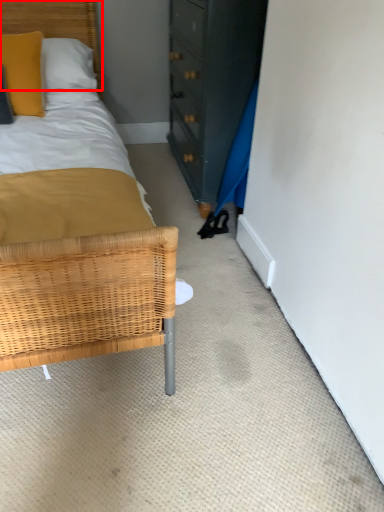
Question: Considering the relative positions of headboard (annotated by the red box) and pillow in the image provided, where is headboard (annotated by the red box) located with respect to the staircase?

Choices:
 (A) right
 (B) left

Answer: (A)